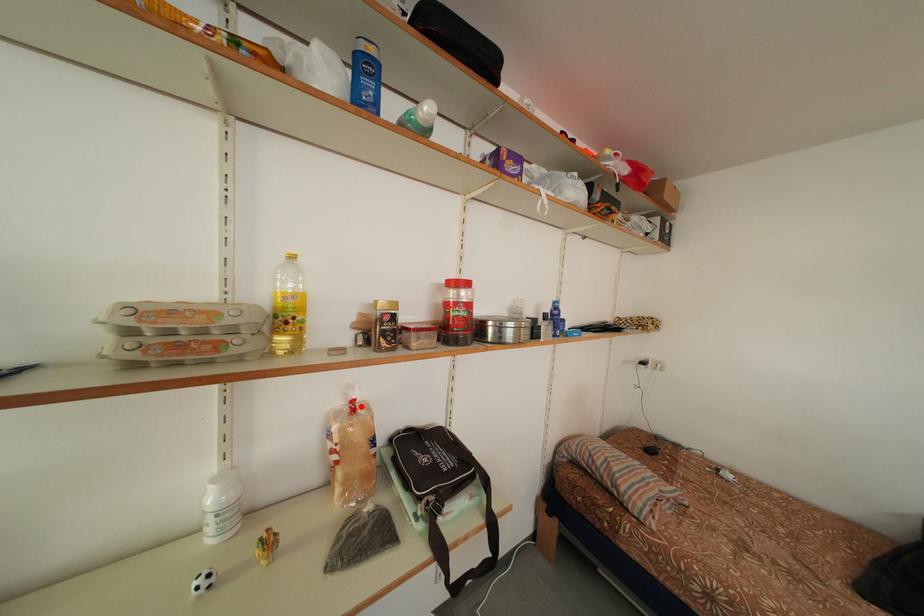
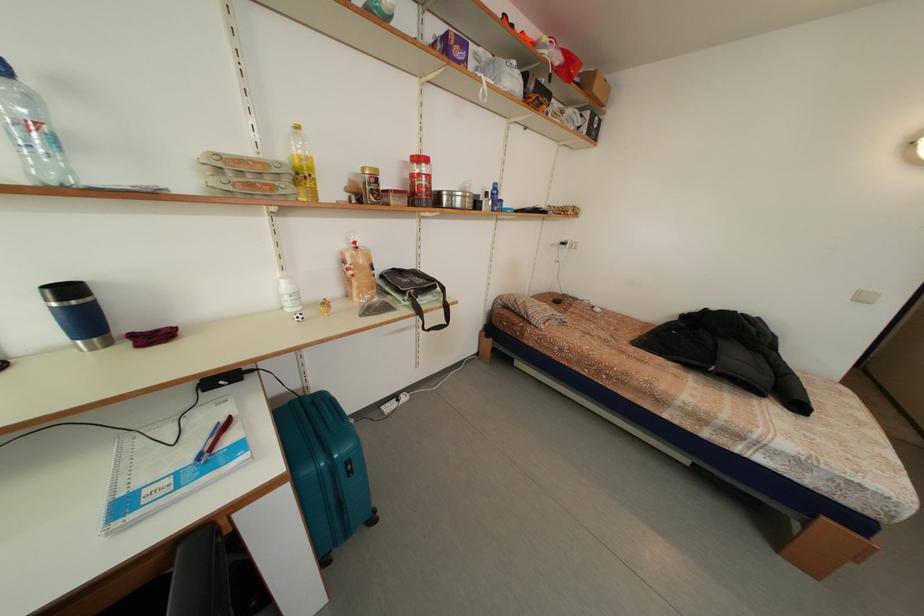
The point at the highlighted location is marked in the first image. Where is the corresponding point in the second image?

(362, 248)